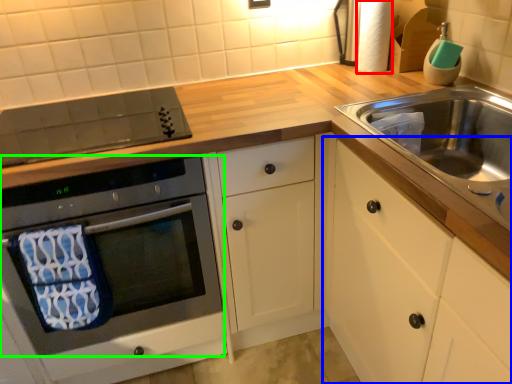
Question: Considering the real-world distances, which object is closest to toilet paper (highlighted by a red box)? cabinetry (highlighted by a blue box) or oven (highlighted by a green box).

Choices:
 (A) cabinetry
 (B) oven

Answer: (A)